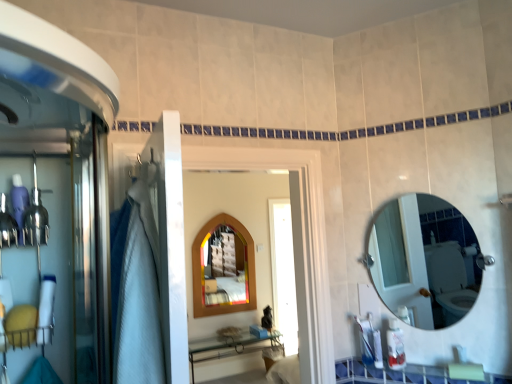
Find the location of a particular element. The image size is (512, 384). free space above clear glass mirror at upper right, which ranks as the 2th mirror in back-to-front order (from a real-world perspective) is located at coordinates (417, 185).